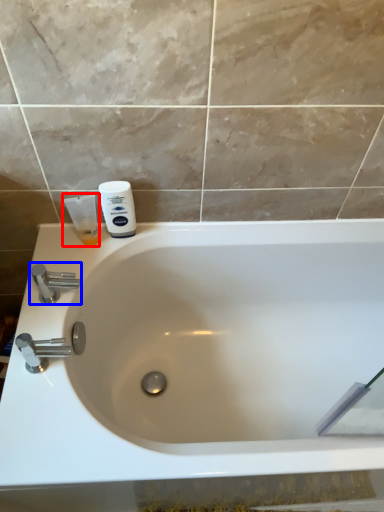
Question: Which of the following is the closest to the observer, shaving cream (highlighted by a red box) or tap (highlighted by a blue box)?

Choices:
 (A) shaving cream
 (B) tap

Answer: (B)